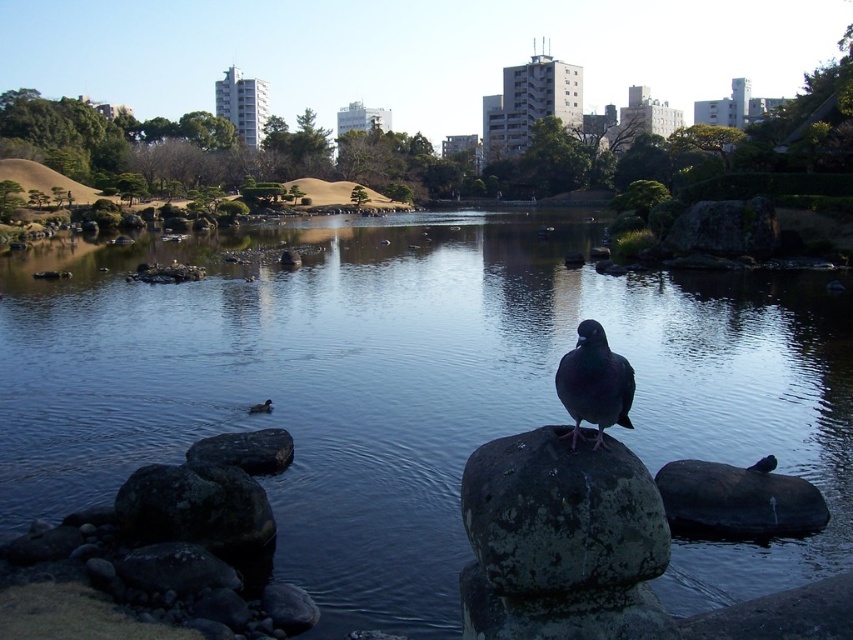
Question: Which object is farther from the camera taking this photo?

Choices:
 (A) dark gray rough rock at lower left
 (B) black smooth rock at right

Answer: (B)

Question: Which of the following is the closest to the observer?

Choices:
 (A) (241, 474)
 (B) (91, 348)
 (C) (607, 394)

Answer: (C)

Question: Estimate the real-world distances between objects in this image. Which object is closer to the black smooth rock at right?

Choices:
 (A) dark gray textured rock at center
 (B) dark gray rough rock at lower left

Answer: (A)

Question: Where is shiny black pigeon at center located in relation to smooth gray rock at center in the image?

Choices:
 (A) below
 (B) above

Answer: (B)

Question: Considering the relative positions of shiny black pigeon at center and smooth gray rock at center in the image provided, where is shiny black pigeon at center located with respect to smooth gray rock at center?

Choices:
 (A) above
 (B) below

Answer: (A)

Question: Can you confirm if shiny black pigeon at center is positioned to the right of smooth gray rock at center?

Choices:
 (A) yes
 (B) no

Answer: (A)